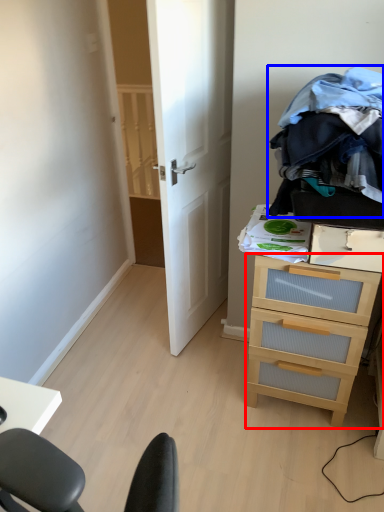
Question: Which object appears closest to the camera in this image, chest of drawers (highlighted by a red box) or clothing (highlighted by a blue box)?

Choices:
 (A) chest of drawers
 (B) clothing

Answer: (B)